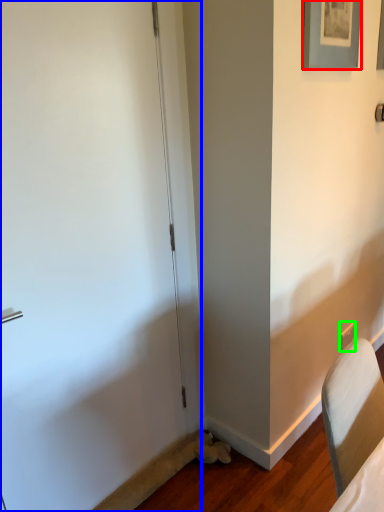
Question: Which object is the farthest from picture frame (highlighted by a red box)? Choose among these: door (highlighted by a blue box) or electric outlet (highlighted by a green box).

Choices:
 (A) door
 (B) electric outlet

Answer: (B)